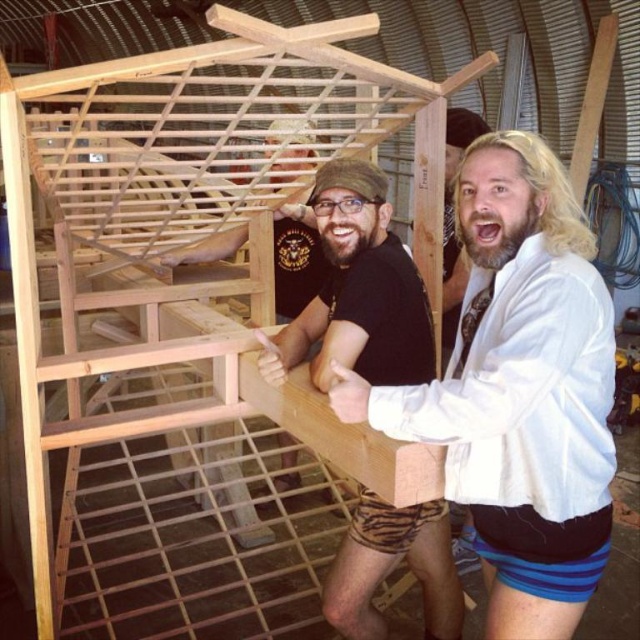
You are standing in the workshop and need to reach the white matte jacket at upper right to hand it to someone. Considering your arm length is 0.7 meters, can you reach it without moving closer?

The white matte jacket at upper right is 1.10 meters away from viewer, which is beyond your arm length of 0.7 meters. Therefore, you cannot reach it without moving closer.